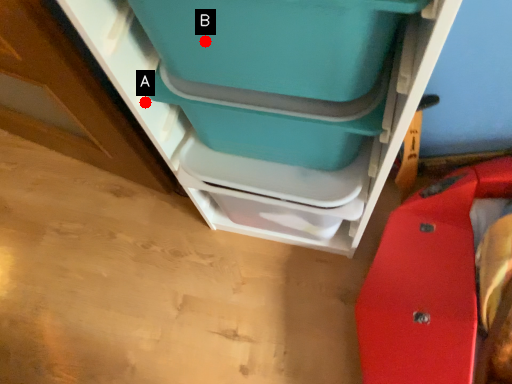
Question: Two points are circled on the image, labeled by A and B beside each circle. Among these points, which one is farthest from the camera?

Choices:
 (A) A is further
 (B) B is further

Answer: (A)